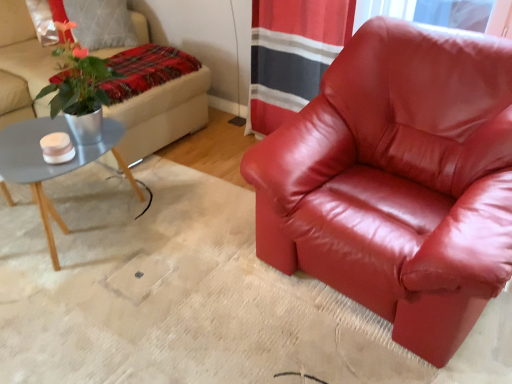
Question: Considering the positions of matte gray coffee table at left and plaid fabric blanket at upper left in the image, is matte gray coffee table at left taller or shorter than plaid fabric blanket at upper left?

Choices:
 (A) tall
 (B) short

Answer: (A)

Question: Looking at their shapes, would you say matte gray coffee table at left is wider or thinner than plaid fabric blanket at upper left?

Choices:
 (A) thin
 (B) wide

Answer: (B)

Question: Estimate the real-world distances between objects in this image. Which object is closer to the plaid fabric blanket at upper left?

Choices:
 (A) satin red armchair at center
 (B) beige fabric studio couch at upper left
 (C) matte gray coffee table at left

Answer: (B)

Question: Which object is the closest to the matte gray coffee table at left?

Choices:
 (A) beige fabric studio couch at upper left
 (B) plaid fabric blanket at upper left
 (C) satin red armchair at center

Answer: (A)